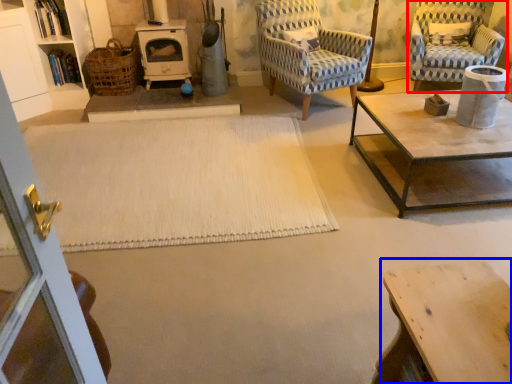
Question: Among these objects, which one is farthest to the camera, chair (highlighted by a red box) or table (highlighted by a blue box)?

Choices:
 (A) chair
 (B) table

Answer: (A)